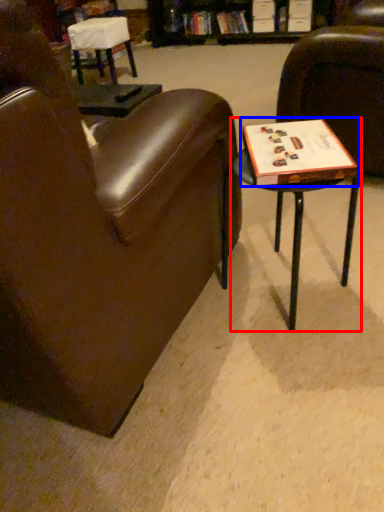
Question: Which object appears closest to the camera in this image, table (highlighted by a red box) or paperback book (highlighted by a blue box)?

Choices:
 (A) table
 (B) paperback book

Answer: (A)